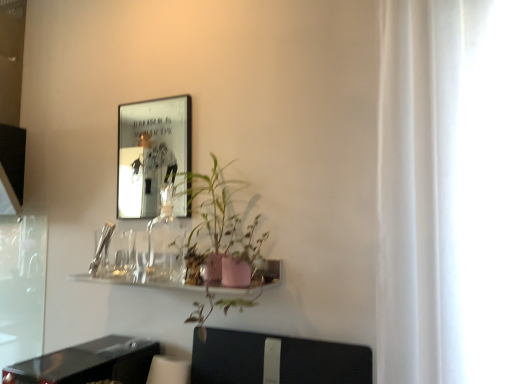
What do you see at coordinates (22, 286) in the screenshot?
I see `transparent glass screen door at left` at bounding box center [22, 286].

This screenshot has height=384, width=512. What do you see at coordinates (220, 245) in the screenshot? I see `pink matte pot at center` at bounding box center [220, 245].

What do you see at coordinates (151, 152) in the screenshot? This screenshot has height=384, width=512. I see `metallic reflective frame at upper left` at bounding box center [151, 152].

What do you see at coordinates (280, 360) in the screenshot?
I see `black plastic swivel chair at lower center` at bounding box center [280, 360].

Locate an element on the screen. transparent glass screen door at left is located at coordinates (22, 286).

Is metallic reflective frame at upper left turned away from pink matte plant pot at center?

metallic reflective frame at upper left is not turned away from pink matte plant pot at center.

Which is more to the right, metallic reflective frame at upper left or pink matte plant pot at center?

pink matte plant pot at center is more to the right.

From the image's perspective, is metallic reflective frame at upper left located above or below pink matte plant pot at center?

Clearly, from the image's perspective, metallic reflective frame at upper left is above pink matte plant pot at center.

Which of these two, black plastic swivel chair at lower center or metallic reflective frame at upper left, is bigger?

Bigger between the two is black plastic swivel chair at lower center.

Considering the positions of points (295, 360) and (153, 162), is point (295, 360) farther from camera compared to point (153, 162)?

That is False.

The width and height of the screenshot is (512, 384). Identify the location of picture frame behind the black plastic swivel chair at lower center. (151, 152).

Is black plastic swivel chair at lower center positioned with its back to metallic reflective frame at upper left?

No.

Can you confirm if transparent glass screen door at left is shorter than metallic reflective frame at upper left?

In fact, transparent glass screen door at left may be taller than metallic reflective frame at upper left.

Could you tell me if transparent glass screen door at left is turned towards metallic reflective frame at upper left?

No, transparent glass screen door at left does not turn towards metallic reflective frame at upper left.

Is point (1, 345) behind point (175, 153)?

No.

From a real-world perspective, does transparent glass screen door at left sit lower than metallic reflective frame at upper left?

Answer: Indeed, from a real-world perspective, transparent glass screen door at left is positioned beneath metallic reflective frame at upper left.

How different are the orientations of pink matte pot at center and metallic reflective frame at upper left in degrees?

They differ by 2.29 degrees in their facing directions.

Is metallic reflective frame at upper left surrounded by pink matte pot at center?

No, metallic reflective frame at upper left is not surrounded by pink matte pot at center.

Does pink matte pot at center have a smaller size compared to metallic reflective frame at upper left?

Actually, pink matte pot at center might be larger than metallic reflective frame at upper left.

Measure the distance from pink matte pot at center to metallic reflective frame at upper left.

10.02 feet.

Can you confirm if black glossy table at lower left is taller than pink matte pot at center?

No, black glossy table at lower left is not taller than pink matte pot at center.

There is a black glossy table at lower left. Identify the location of houseplant above it (from a real-world perspective). Image resolution: width=512 pixels, height=384 pixels. (220, 245).

From the image's perspective, which is above, black glossy table at lower left or pink matte pot at center?

pink matte pot at center, from the image's perspective.

Is point (5, 371) farther from viewer compared to point (218, 168)?

Yes.

Who is bigger, pink matte pot at center or black plastic swivel chair at lower center?

Bigger between the two is pink matte pot at center.

What's the angular difference between pink matte pot at center and black plastic swivel chair at lower center's facing directions?

The facing directions of pink matte pot at center and black plastic swivel chair at lower center are 1.5 degrees apart.

Considering the positions of points (226, 271) and (248, 335), is point (226, 271) farther from camera compared to point (248, 335)?

No, it is in front of (248, 335).

Which of these two, black glossy table at lower left or transparent glass screen door at left, stands taller?

transparent glass screen door at left is taller.

Which is correct: black glossy table at lower left is inside transparent glass screen door at left, or outside of it?

black glossy table at lower left exists outside the volume of transparent glass screen door at left.

Does point (37, 362) come farther from viewer compared to point (16, 239)?

No, (37, 362) is closer to viewer.

Image resolution: width=512 pixels, height=384 pixels. I want to click on picture frame that appears behind the pink matte plant pot at center, so click(151, 152).

You are a GUI agent. You are given a task and a screenshot of the screen. Output one action in this format:
    pyautogui.click(x=<x>, y=<y>)
    Task: Click on the picture frame positioned vertically above the black plastic swivel chair at lower center (from a real-world perspective)
    This screenshot has width=512, height=384.
    Given the screenshot: What is the action you would take?
    pyautogui.click(x=151, y=152)

Which object lies nearer to the anchor point transparent glass screen door at left, black plastic swivel chair at lower center or pink matte pot at center?

pink matte pot at center is closer to transparent glass screen door at left.

Looking at the image, which one is located closer to transparent glass screen door at left, pink matte plant pot at center or black glossy table at lower left?

Based on the image, pink matte plant pot at center appears to be nearer to transparent glass screen door at left.

Estimate the real-world distances between objects in this image. Which object is further from metallic reflective frame at upper left, black plastic swivel chair at lower center or pink matte plant pot at center?

The object further to metallic reflective frame at upper left is black plastic swivel chair at lower center.

Estimate the real-world distances between objects in this image. Which object is closer to black glossy table at lower left, black plastic swivel chair at lower center or metallic reflective frame at upper left?

black plastic swivel chair at lower center lies closer to black glossy table at lower left than the other object.

Considering their positions, is black plastic swivel chair at lower center positioned closer to transparent glass screen door at left than metallic reflective frame at upper left?

Based on the image, black plastic swivel chair at lower center appears to be nearer to transparent glass screen door at left.

When comparing their distances from pink matte pot at center, does black glossy table at lower left or transparent glass screen door at left seem further?

transparent glass screen door at left is positioned further to the anchor pink matte pot at center.

Estimate the real-world distances between objects in this image. Which object is further from pink matte plant pot at center, black plastic swivel chair at lower center or pink matte pot at center?

black plastic swivel chair at lower center lies further to pink matte plant pot at center than the other object.

Based on their spatial positions, is pink matte plant pot at center or black plastic swivel chair at lower center further from transparent glass screen door at left?

Among the two, black plastic swivel chair at lower center is located further to transparent glass screen door at left.

Where is `picture frame situated between transparent glass screen door at left and pink matte plant pot at center from left to right`? The image size is (512, 384). picture frame situated between transparent glass screen door at left and pink matte plant pot at center from left to right is located at coordinates (151, 152).

I want to click on picture frame situated between transparent glass screen door at left and pink matte pot at center from left to right, so click(151, 152).

Where is `shelf located between transparent glass screen door at left and pink matte pot at center in the left-right direction`? This screenshot has width=512, height=384. shelf located between transparent glass screen door at left and pink matte pot at center in the left-right direction is located at coordinates (136, 281).

The height and width of the screenshot is (384, 512). In order to click on shelf between black glossy table at lower left and pink matte pot at center from left to right in this screenshot , I will do `click(136, 281)`.